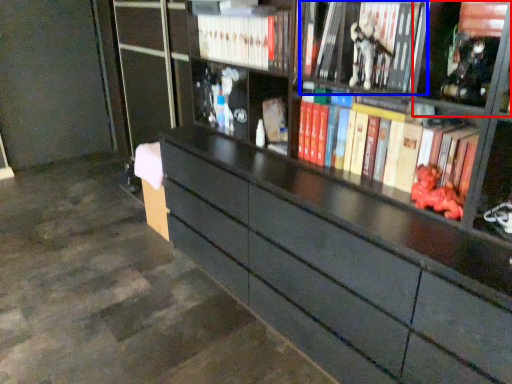
Question: Which point is closer to the camera, cabinet (highlighted by a red box) or book (highlighted by a blue box)?

Choices:
 (A) cabinet
 (B) book

Answer: (A)